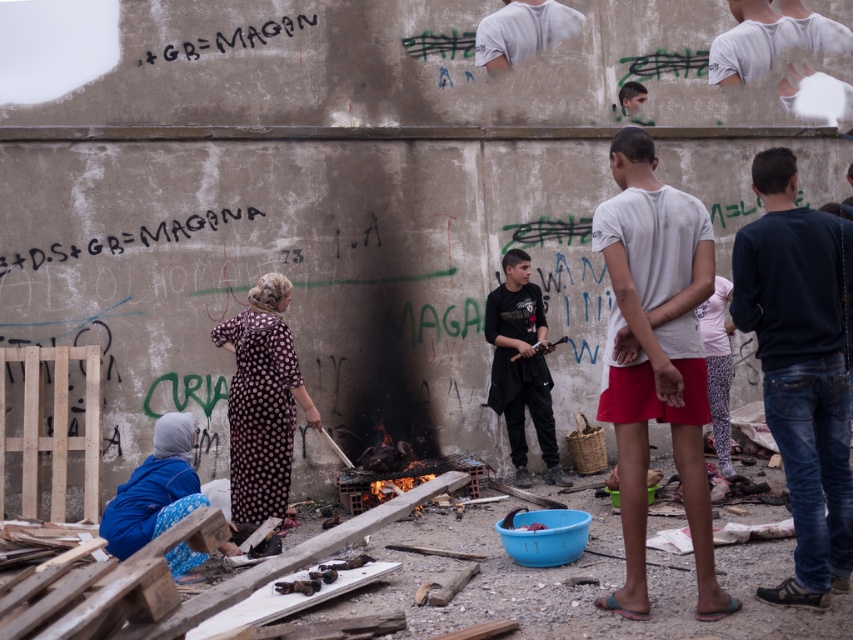
Question: Estimate the real-world distances between objects in this image. Which object is closer to the black graffiti at upper left?

Choices:
 (A) blue fabric at lower left
 (B) white leopard print leggings at center
 (C) black matte shirt at center

Answer: (A)

Question: Can you confirm if white cotton shirt at center is positioned above black graffiti at upper left?

Choices:
 (A) yes
 (B) no

Answer: (B)

Question: From the image, what is the correct spatial relationship of dark blue jeans at right in relation to blue fabric at lower left?

Choices:
 (A) right
 (B) left

Answer: (A)

Question: Among these points, which one is farthest from the camera?

Choices:
 (A) (149, 58)
 (B) (258, 388)
 (C) (167, 234)
 (D) (767, 156)

Answer: (A)

Question: Which of the following is the closest to the observer?

Choices:
 (A) (135, 246)
 (B) (175, 563)
 (C) (706, 529)
 (D) (524, 310)

Answer: (C)

Question: Can you confirm if black graffiti at upper left is positioned to the right of white leopard print leggings at center?

Choices:
 (A) no
 (B) yes

Answer: (A)